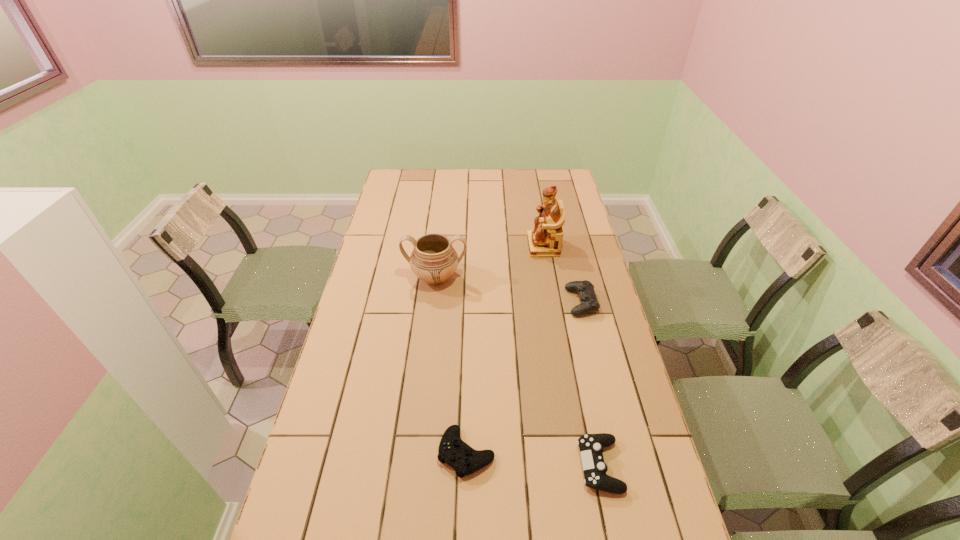
Locate an element on the screen. figurine is located at coordinates (545, 240).

The width and height of the screenshot is (960, 540). Identify the location of the farthest object. (545, 240).

Image resolution: width=960 pixels, height=540 pixels. What are the coordinates of `urn` in the screenshot? It's located at [434, 260].

This screenshot has width=960, height=540. Identify the location of the farthest control. (589, 303).

I want to click on the leftmost control, so click(465, 460).

Identify the location of the shortest object. (465, 460).

Locate an element on the screen. This screenshot has width=960, height=540. vacant space located 0.120m on the front-facing side of the tallest object is located at coordinates (499, 246).

Identify the location of vacant region located 0.150m on the front-facing side of the tallest object. The image size is (960, 540). (492, 246).

You are a GUI agent. You are given a task and a screenshot of the screen. Output one action in this format:
    pyautogui.click(x=<x>, y=<y>)
    Task: Click on the blank space located 0.230m on the front-facing side of the tallest object
    The height and width of the screenshot is (540, 960).
    Given the screenshot: What is the action you would take?
    click(x=472, y=246)

Locate an element on the screen. The image size is (960, 540). vacant space located on the front-facing side of the urn is located at coordinates (423, 385).